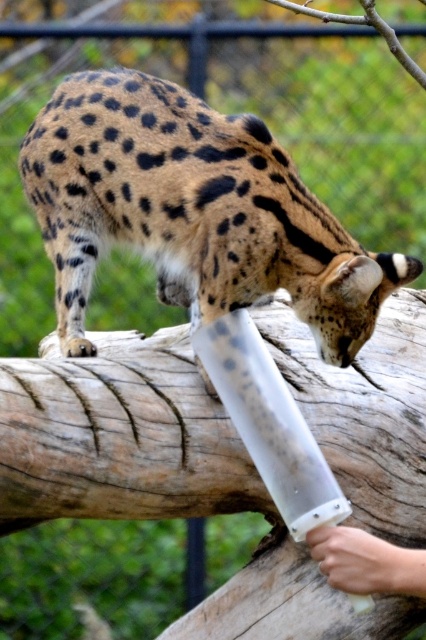
Question: Among these points, which one is nearest to the camera?

Choices:
 (A) (365, 586)
 (B) (284, 214)

Answer: (A)

Question: Considering the relative positions of spotted fur cheetah at upper center and smooth skin hand at lower right in the image provided, where is spotted fur cheetah at upper center located with respect to smooth skin hand at lower right?

Choices:
 (A) below
 (B) above

Answer: (B)

Question: Can you confirm if spotted fur cheetah at upper center is smaller than smooth skin hand at lower right?

Choices:
 (A) yes
 (B) no

Answer: (B)

Question: In this image, where is spotted fur cheetah at upper center located relative to smooth skin hand at lower right?

Choices:
 (A) above
 (B) below

Answer: (A)

Question: Which of the following is the closest to the observer?

Choices:
 (A) spotted fur cheetah at upper center
 (B) smooth skin hand at lower right

Answer: (B)